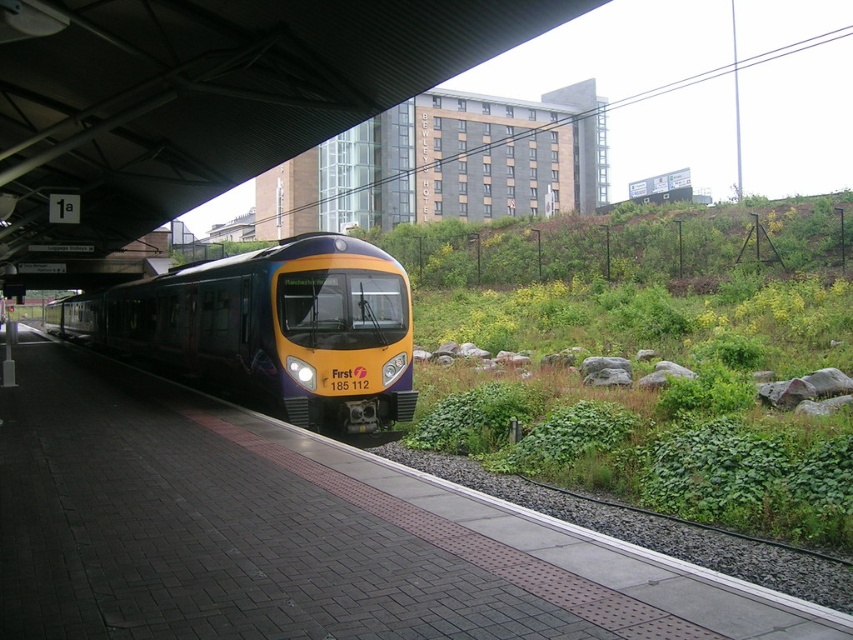
Question: Does brick platform at center lie in front of matte black train at center?

Choices:
 (A) no
 (B) yes

Answer: (B)

Question: Does brick platform at center appear over matte black train at center?

Choices:
 (A) yes
 (B) no

Answer: (B)

Question: Which object appears farthest from the camera in this image?

Choices:
 (A) brick platform at center
 (B) matte black train at center

Answer: (B)

Question: Does brick platform at center have a smaller size compared to matte black train at center?

Choices:
 (A) no
 (B) yes

Answer: (B)

Question: Which object is farther from the camera taking this photo?

Choices:
 (A) brick platform at center
 (B) matte black train at center

Answer: (B)

Question: Which point appears closest to the camera in this image?

Choices:
 (A) (651, 595)
 (B) (293, 394)

Answer: (A)